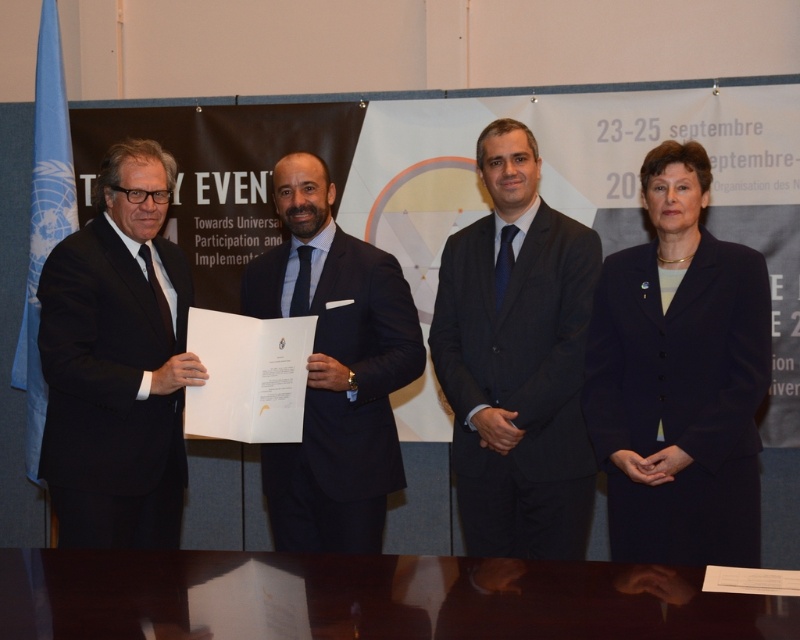
Question: Estimate the real-world distances between objects in this image. Which object is farther from the black matte suit at left?

Choices:
 (A) glossy wooden table at lower center
 (B) dark blue suit at center
 (C) dark blue suit at right
 (D) black matte suit at center

Answer: (C)

Question: Can you confirm if dark blue suit at right is smaller than dark blue suit at center?

Choices:
 (A) yes
 (B) no

Answer: (A)

Question: Does dark blue suit at right have a smaller size compared to black matte suit at center?

Choices:
 (A) no
 (B) yes

Answer: (B)

Question: Which is nearer to the black matte suit at left?

Choices:
 (A) black matte suit at center
 (B) glossy wooden table at lower center

Answer: (A)

Question: Does dark blue suit at right come behind black matte suit at center?

Choices:
 (A) no
 (B) yes

Answer: (A)

Question: Estimate the real-world distances between objects in this image. Which object is closer to the dark blue suit at right?

Choices:
 (A) black matte suit at left
 (B) black matte suit at center
 (C) dark blue suit at center

Answer: (C)